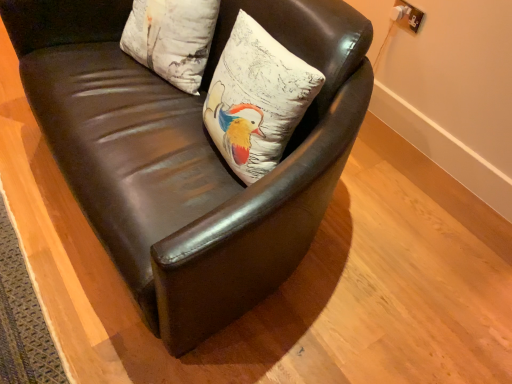
Identify the location of spots to the right of brown leather chair at center. Image resolution: width=512 pixels, height=384 pixels. coord(411,242).